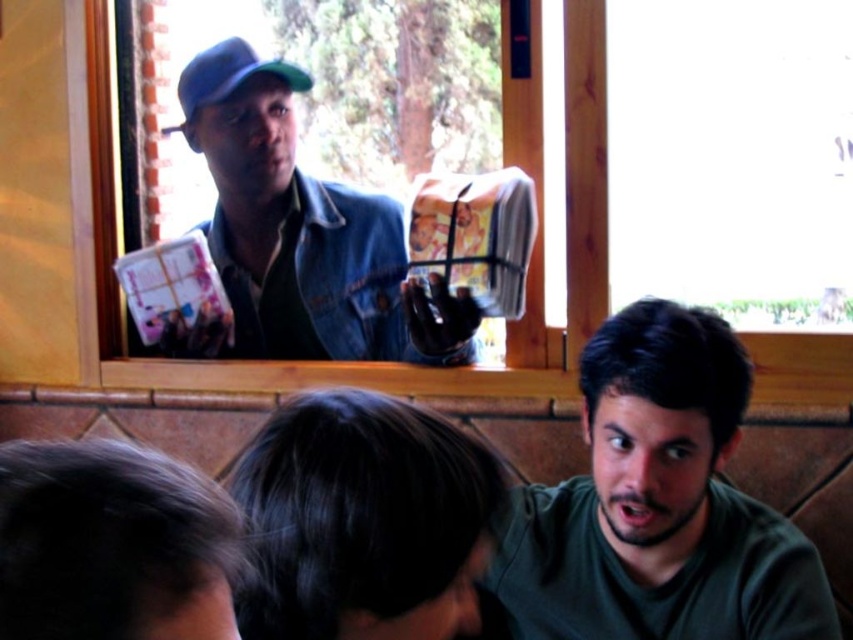
Is green matte shirt at lower right above green matte baseball cap at upper left?

No.

Can you confirm if green matte shirt at lower right is positioned below green matte baseball cap at upper left?

Correct, green matte shirt at lower right is located below green matte baseball cap at upper left.

Is point (630, 406) positioned behind point (189, 138)?

That is False.

In order to click on green matte shirt at lower right in this screenshot , I will do `click(659, 504)`.

Is point (651, 417) in front of point (494, 480)?

No, it is not.

Is green matte shirt at lower right below dark brown hair at lower center?

Yes, green matte shirt at lower right is below dark brown hair at lower center.

Does point (640, 403) come farther from viewer compared to point (289, 529)?

Yes, point (640, 403) is farther from viewer.

Find the location of a particular element. The height and width of the screenshot is (640, 853). green matte shirt at lower right is located at coordinates (659, 504).

Is dark brown hair at lower center positioned in front of green matte baseball cap at upper left?

Yes.

Is dark brown hair at lower center wider than green matte baseball cap at upper left?

No.

Does point (459, 458) come in front of point (216, 49)?

Yes, it is.

Where is `dark brown hair at lower center`? This screenshot has height=640, width=853. dark brown hair at lower center is located at coordinates (360, 518).